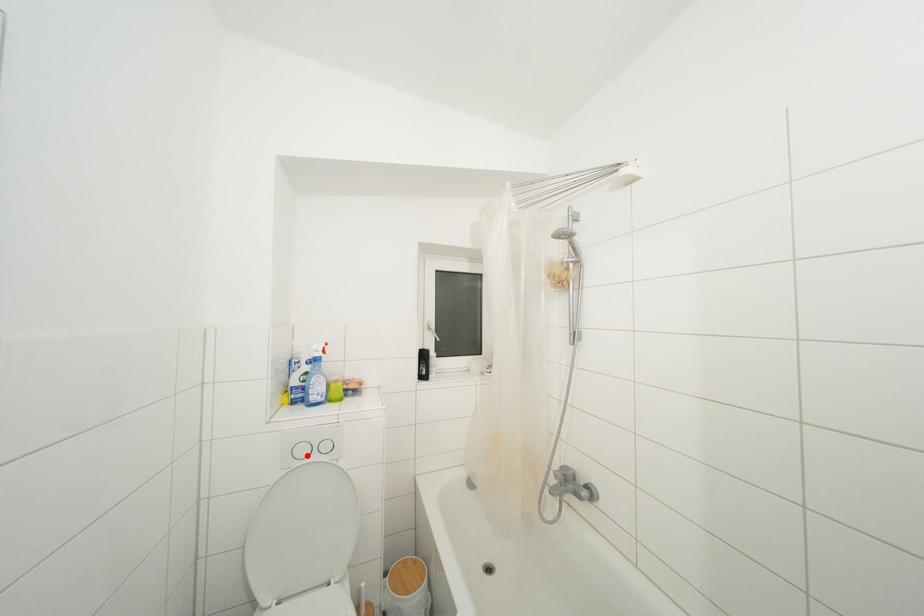
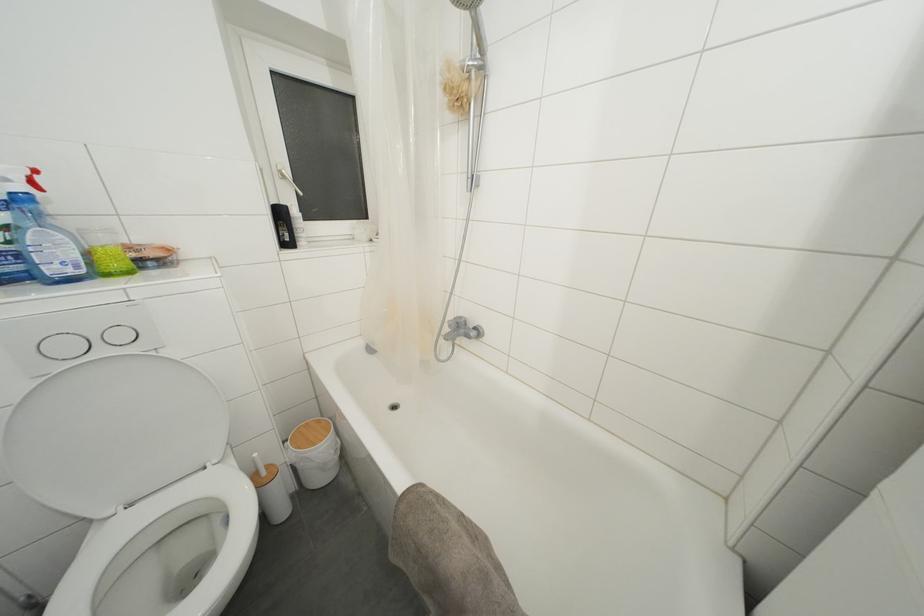
Find the pixel in the second image that matches the highlighted location in the first image.

(71, 352)